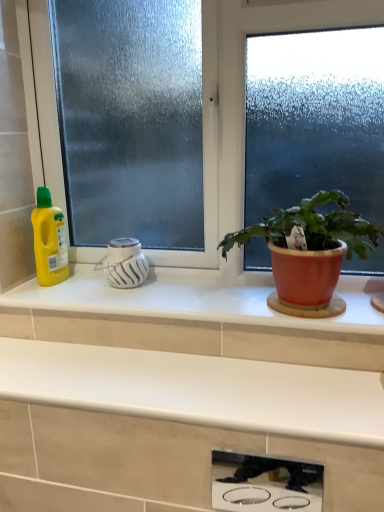
Find the location of `blank space situated above white matte countertop at center, which appears as the 2th countertop when viewed from the top (from a real-world perspective)`. blank space situated above white matte countertop at center, which appears as the 2th countertop when viewed from the top (from a real-world perspective) is located at coordinates (165, 377).